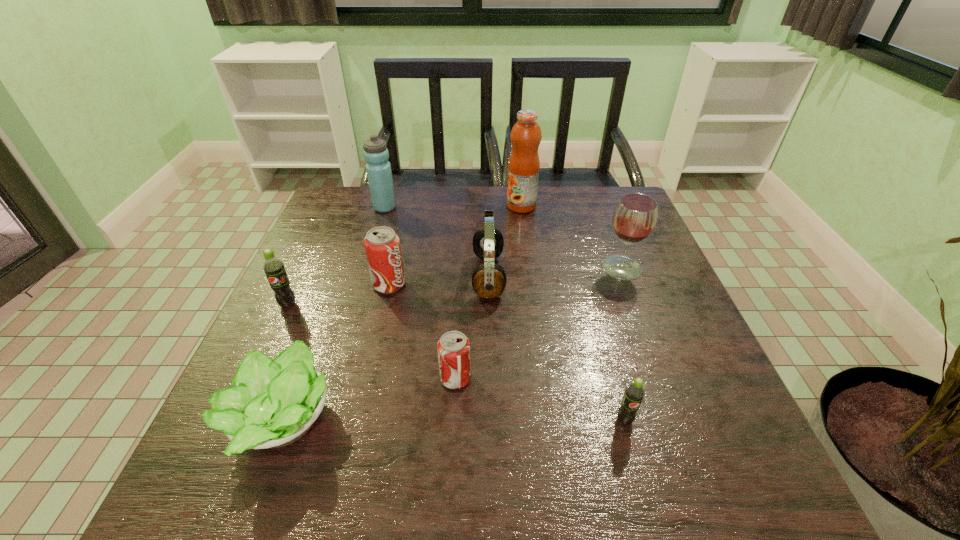
The width and height of the screenshot is (960, 540). I want to click on object present at the near edge, so click(273, 403).

Identify the location of water bottle that is at the left edge. (378, 168).

What are the coordinates of `soda that is at the left edge` in the screenshot? It's located at (273, 267).

Where is `lettuce located at the left edge`? The image size is (960, 540). lettuce located at the left edge is located at coordinates (273, 403).

The width and height of the screenshot is (960, 540). I want to click on object present at the right edge, so click(x=634, y=218).

Image resolution: width=960 pixels, height=540 pixels. Identify the location of object located in the far left corner section of the desktop. (378, 168).

Image resolution: width=960 pixels, height=540 pixels. What are the coordinates of `object that is at the near left corner` in the screenshot? It's located at (273, 403).

Locate an element on the screen. free space at the far edge of the desktop is located at coordinates (456, 230).

You are a GUI agent. You are given a task and a screenshot of the screen. Output one action in this format:
    pyautogui.click(x=<x>, y=<y>)
    Task: Click on the free space at the near edge of the desktop
    
    Given the screenshot: What is the action you would take?
    pyautogui.click(x=668, y=488)

Locate an element on the screen. This screenshot has width=960, height=540. vacant space at the left edge is located at coordinates (348, 266).